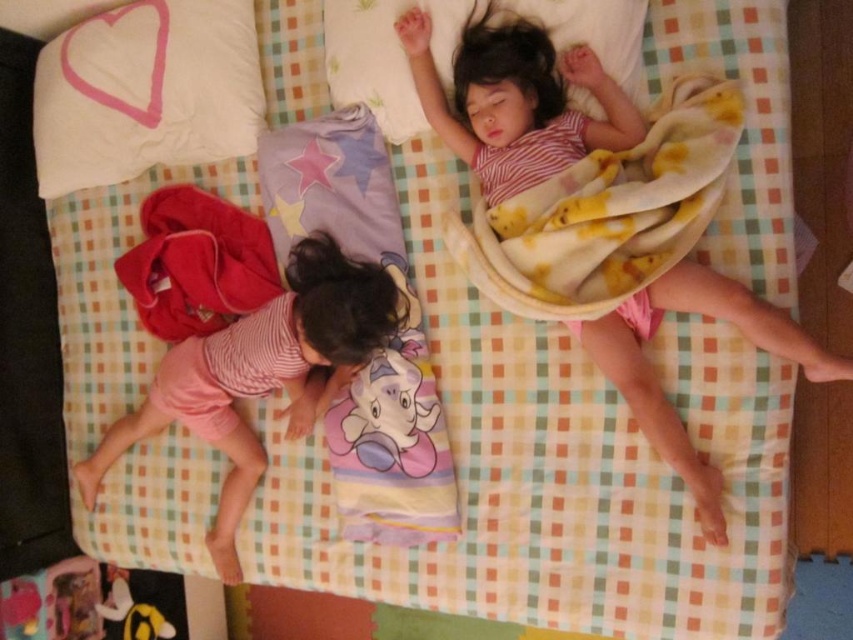
Does white soft pillow at upper left have a larger size compared to pink striped shirt at lower left?

No, white soft pillow at upper left is not bigger than pink striped shirt at lower left.

Which of these two, white soft pillow at upper left or pink striped shirt at lower left, stands taller?

pink striped shirt at lower left

Between point (163, 108) and point (256, 348), which one is positioned in front?

Point (256, 348) is more forward.

Locate an element on the screen. Image resolution: width=853 pixels, height=640 pixels. white soft pillow at upper left is located at coordinates (146, 92).

Does point (657, 422) come behind point (175, 384)?

No, it is not.

Which is more to the left, pink cotton blanket at upper right or pink striped shirt at lower left?

From the viewer's perspective, pink striped shirt at lower left appears more on the left side.

Which is in front, point (519, 93) or point (109, 433)?

Positioned in front is point (519, 93).

I want to click on pink cotton blanket at upper right, so click(x=515, y=99).

Does point (618, 102) come closer to viewer compared to point (358, 394)?

Yes, it is.

Which is behind, point (503, 99) or point (410, 371)?

The point (410, 371) is more distant.

Image resolution: width=853 pixels, height=640 pixels. Identify the location of pink cotton blanket at upper right. (x=515, y=99).